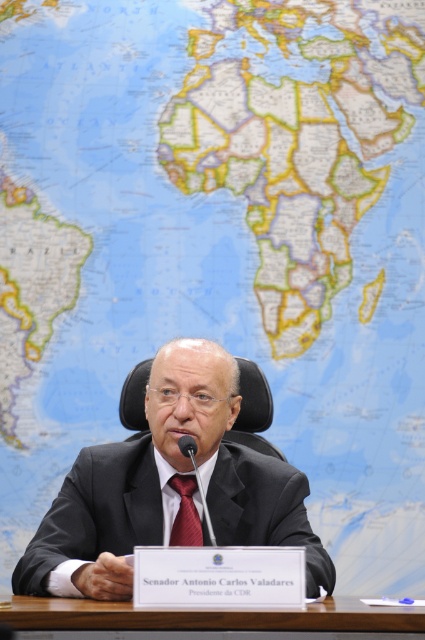
Does point (354, 632) come closer to viewer compared to point (189, 445)?

Yes, point (354, 632) is in front of point (189, 445).

Is brown wooden table at center above black plastic microphone at center?

Incorrect, brown wooden table at center is not positioned above black plastic microphone at center.

Where is `brown wooden table at center`? Image resolution: width=425 pixels, height=640 pixels. brown wooden table at center is located at coordinates (209, 618).

What are the coordinates of `brown wooden table at center` in the screenshot? It's located at (209, 618).

Does black suit at center have a lesser width compared to matte black microphone at center?

Incorrect, black suit at center's width is not less than matte black microphone at center's.

Can you confirm if black suit at center is shorter than matte black microphone at center?

In fact, black suit at center may be taller than matte black microphone at center.

The height and width of the screenshot is (640, 425). I want to click on black suit at center, so click(x=167, y=486).

Is black suit at center thinner than brown wooden table at center?

Yes, black suit at center is thinner than brown wooden table at center.

Looking at this image, how far apart are black suit at center and brown wooden table at center?

black suit at center is 29.54 centimeters away from brown wooden table at center.

The image size is (425, 640). Describe the element at coordinates (167, 486) in the screenshot. I see `black suit at center` at that location.

Locate an element on the screen. This screenshot has height=640, width=425. black suit at center is located at coordinates (167, 486).